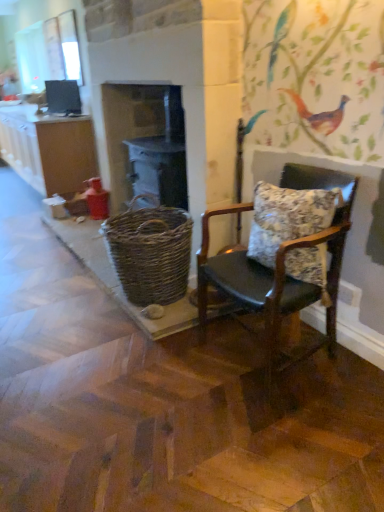
What do you see at coordinates (63, 97) in the screenshot? I see `matte black monitor at upper left` at bounding box center [63, 97].

This screenshot has height=512, width=384. I want to click on woven wood basket at center, so click(145, 143).

This screenshot has height=512, width=384. What are the coordinates of `floral fabric pillow at right` in the screenshot? It's located at (287, 218).

In order to face woven brown basket at center, should I rotate leftwards or rightwards?

To align with it, rotate left about 5.650°.

You are a GUI agent. You are given a task and a screenshot of the screen. Output one action in this format:
    pyautogui.click(x=<x>, y=<y>)
    Task: Click on the clear glass window at upper left
    The image size is (384, 512).
    Given the screenshot: What is the action you would take?
    pyautogui.click(x=63, y=47)

The height and width of the screenshot is (512, 384). I want to click on matte black monitor at upper left, so click(x=63, y=97).

Which point is more forward, [43,139] or [53,22]?

The point [43,139] is more forward.

From a real-world perspective, is matte brown cabinet at left positioned above or below clear glass window at upper left?

matte brown cabinet at left is situated lower than clear glass window at upper left in the real world.

Consider the image. From the image's perspective, which is below, matte brown cabinet at left or clear glass window at upper left?

matte brown cabinet at left.

Is matte brown cabinet at left with clear glass window at upper left?

No, matte brown cabinet at left is not next to clear glass window at upper left.

Could you tell me if woven wood basket at center is turned towards clear glass window at upper left?

No, woven wood basket at center is not oriented towards clear glass window at upper left.

From the image's perspective, is woven wood basket at center above clear glass window at upper left?

No, from the image's perspective, woven wood basket at center is not above clear glass window at upper left.

Where is `fireplace below the clear glass window at upper left (from a real-world perspective)`? fireplace below the clear glass window at upper left (from a real-world perspective) is located at coordinates (145, 143).

Is woven wood basket at center positioned before clear glass window at upper left?

Yes, woven wood basket at center is closer to the viewer.

Considering the sizes of objects matte brown cabinet at left and floral fabric pillow at right in the image provided, who is thinner, matte brown cabinet at left or floral fabric pillow at right?

floral fabric pillow at right.

Would you say matte brown cabinet at left is inside or outside floral fabric pillow at right?

The correct answer is: outside.

What's the angular difference between matte brown cabinet at left and floral fabric pillow at right's facing directions?

The angular difference between matte brown cabinet at left and floral fabric pillow at right is 0.858 degrees.

Based on their positions, is floral fabric pillow at right located to the left or right of woven wood basket at center?

floral fabric pillow at right is positioned on woven wood basket at center's right side.

Is floral fabric pillow at right spatially inside woven wood basket at center, or outside of it?

floral fabric pillow at right is located beyond the bounds of woven wood basket at center.

Considering the positions of point (317, 210) and point (182, 148), is point (317, 210) closer or farther from the camera than point (182, 148)?

Point (317, 210) is positioned closer to the camera compared to point (182, 148).

From a real-world perspective, does leather cushioned chair at right stand above matte black monitor at upper left?

No.

Considering the relative positions of leather cushioned chair at right and matte black monitor at upper left in the image provided, is leather cushioned chair at right to the left or to the right of matte black monitor at upper left?

Clearly, leather cushioned chair at right is on the right of matte black monitor at upper left in the image.

Is matte black monitor at upper left a part of leather cushioned chair at right?

That's incorrect, matte black monitor at upper left is not inside leather cushioned chair at right.

Can you see leather cushioned chair at right touching matte black monitor at upper left?

No, leather cushioned chair at right is not in contact with matte black monitor at upper left.

Are clear glass window at upper left and floral fabric pillow at right far apart?

Absolutely, clear glass window at upper left is distant from floral fabric pillow at right.

Image resolution: width=384 pixels, height=512 pixels. In the image, there is a clear glass window at upper left. Identify the location of pillow below it (from the image's perspective). point(287,218).

Which object is further away from the camera, clear glass window at upper left or floral fabric pillow at right?

clear glass window at upper left is further away from the camera.

Considering the relative sizes of leather cushioned chair at right and floral fabric pillow at right in the image provided, is leather cushioned chair at right shorter than floral fabric pillow at right?

Incorrect, the height of leather cushioned chair at right does not fall short of that of floral fabric pillow at right.

Considering the points (286, 310) and (320, 257), which point is in front, point (286, 310) or point (320, 257)?

The point (320, 257) is more forward.

From a real-world perspective, is leather cushioned chair at right physically above floral fabric pillow at right?

Incorrect, from a real-world perspective, leather cushioned chair at right is lower than floral fabric pillow at right.

Locate an element on the screen. window screen above the matte brown cabinet at left (from a real-world perspective) is located at coordinates (63, 47).

Identify the location of window screen that appears behind the woven wood basket at center. (63, 47).

Considering their positions, is matte black monitor at upper left positioned further to clear glass window at upper left than woven brown basket at center?

woven brown basket at center lies further to clear glass window at upper left than the other object.

In the scene shown: Looking at the image, which one is located further to matte black monitor at upper left, woven wood basket at center or clear glass window at upper left?

woven wood basket at center is positioned further to the anchor matte black monitor at upper left.

Considering their positions, is leather cushioned chair at right positioned closer to floral fabric pillow at right than woven brown basket at center?

Among the two, leather cushioned chair at right is located nearer to floral fabric pillow at right.

Looking at the image, which one is located closer to matte brown cabinet at left, floral fabric pillow at right or woven brown basket at center?

woven brown basket at center is closer to matte brown cabinet at left.

Estimate the real-world distances between objects in this image. Which object is closer to woven brown basket at center, matte brown cabinet at left or leather cushioned chair at right?

Among the two, leather cushioned chair at right is located nearer to woven brown basket at center.

Looking at the image, which one is located further to leather cushioned chair at right, matte brown cabinet at left or woven wood basket at center?

Among the two, matte brown cabinet at left is located further to leather cushioned chair at right.

Looking at the image, which one is located closer to floral fabric pillow at right, woven wood basket at center or woven brown basket at center?

woven brown basket at center lies closer to floral fabric pillow at right than the other object.

Looking at the image, which one is located further to matte brown cabinet at left, woven brown basket at center or clear glass window at upper left?

woven brown basket at center is further to matte brown cabinet at left.

I want to click on fireplace located between floral fabric pillow at right and matte black monitor at upper left in the depth direction, so click(x=145, y=143).

Identify the location of fireplace positioned between floral fabric pillow at right and clear glass window at upper left from near to far. Image resolution: width=384 pixels, height=512 pixels. (145, 143).

Locate an element on the screen. The width and height of the screenshot is (384, 512). fireplace situated between matte brown cabinet at left and floral fabric pillow at right from left to right is located at coordinates (145, 143).

Identify the location of fireplace positioned between leather cushioned chair at right and clear glass window at upper left from near to far. (145, 143).